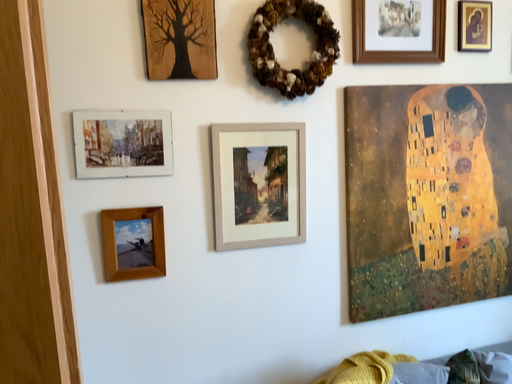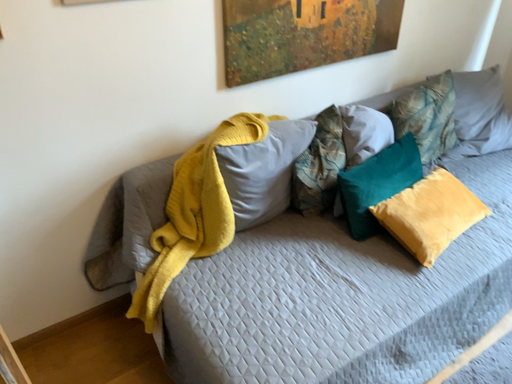
Question: Which way did the camera rotate in the video?

Choices:
 (A) rotated upward
 (B) rotated downward

Answer: (B)